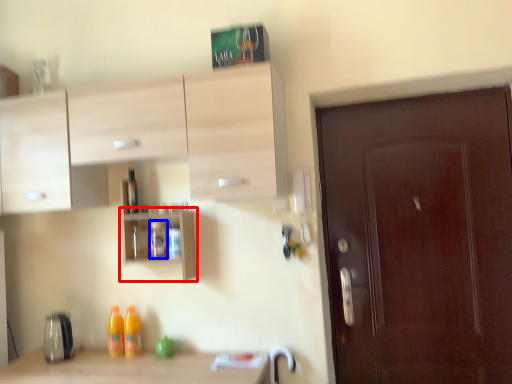
Question: Which object is closer to the camera taking this photo, shelf (highlighted by a red box) or bottle (highlighted by a blue box)?

Choices:
 (A) shelf
 (B) bottle

Answer: (A)